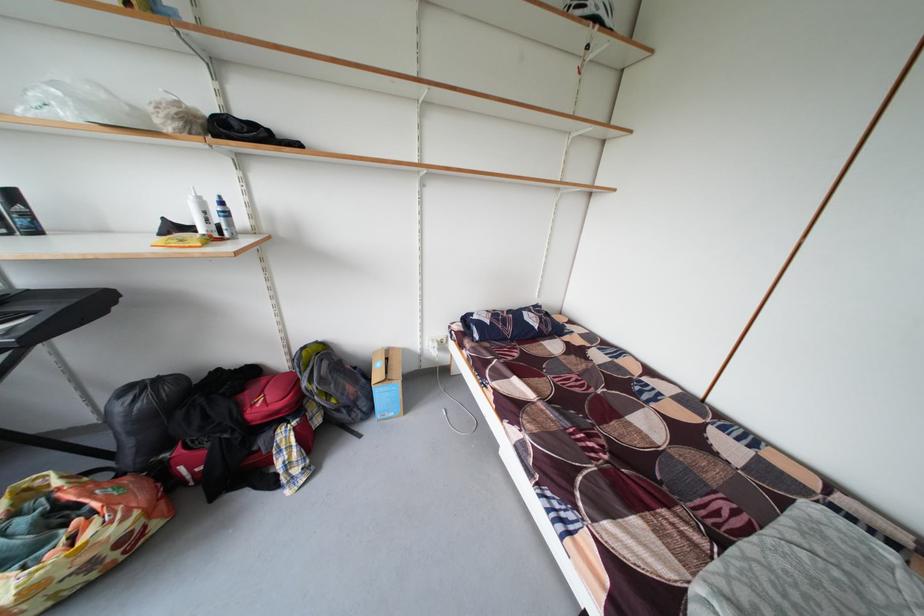
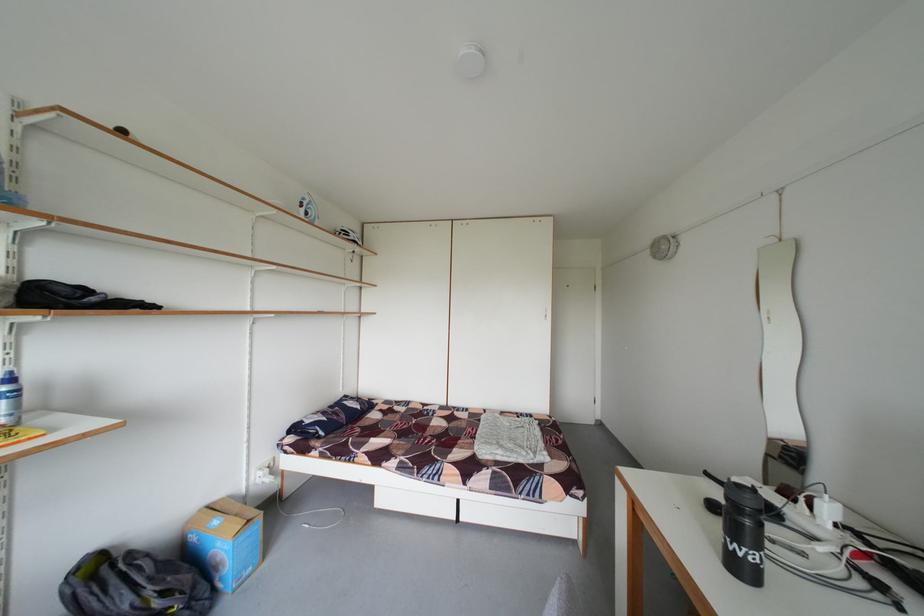
Find the pixel in the second image that matches [409,354] in the first image.

(233, 505)